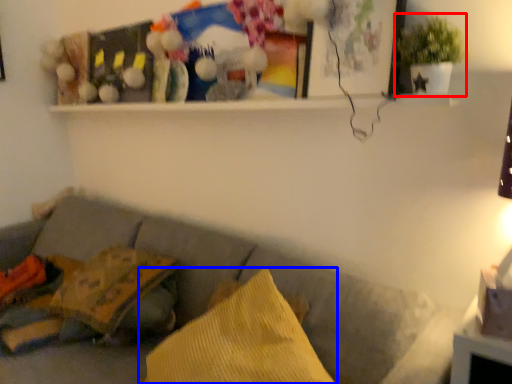
Question: Which object is further to the camera taking this photo, houseplant (highlighted by a red box) or pillow (highlighted by a blue box)?

Choices:
 (A) houseplant
 (B) pillow

Answer: (A)